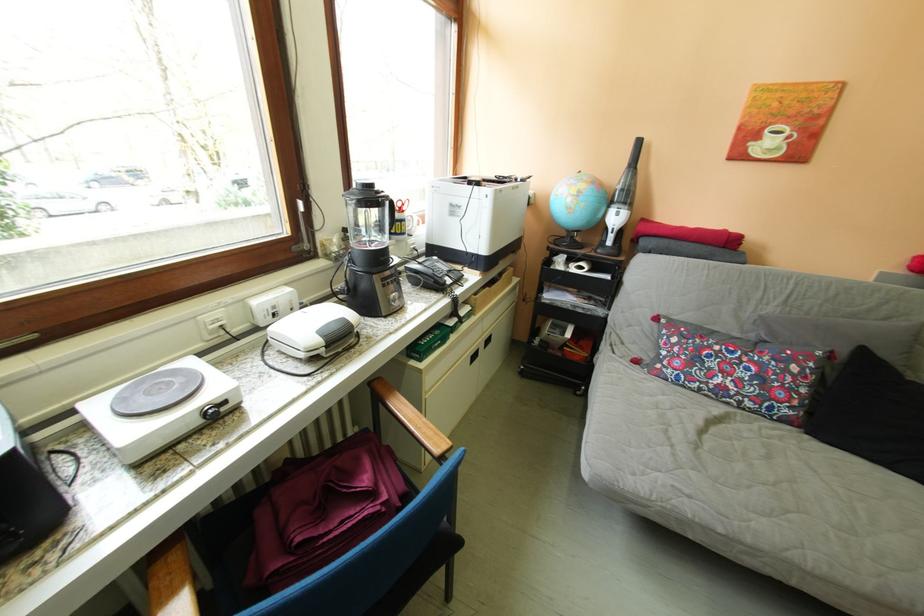
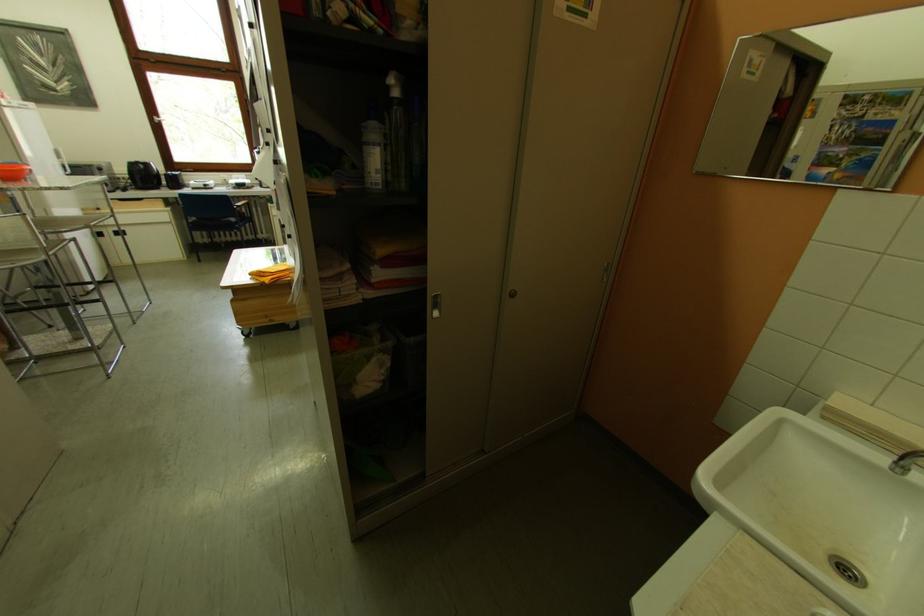
Question: I am providing you with two images of the same scene from different viewpoints. After the viewpoint changes to image2, which objects are now occluded?

Choices:
 (A) spray bottle trigger
 (B) lamp pull cord
 (C) telephone handset
 (D) cabinet door handle

Answer: (C)